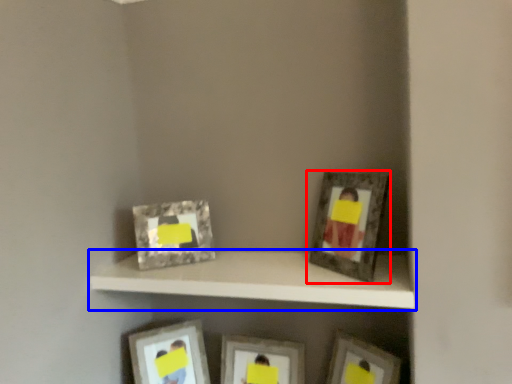
Question: Which object appears farthest to the camera in this image, picture frame (highlighted by a red box) or shelf (highlighted by a blue box)?

Choices:
 (A) picture frame
 (B) shelf

Answer: (A)